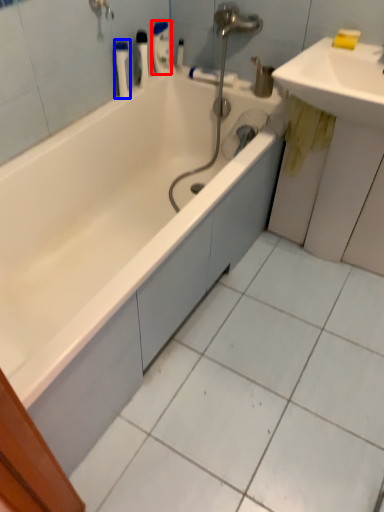
Question: Which object appears farthest to the camera in this image, toiletry (highlighted by a red box) or toiletry (highlighted by a blue box)?

Choices:
 (A) toiletry
 (B) toiletry

Answer: (A)